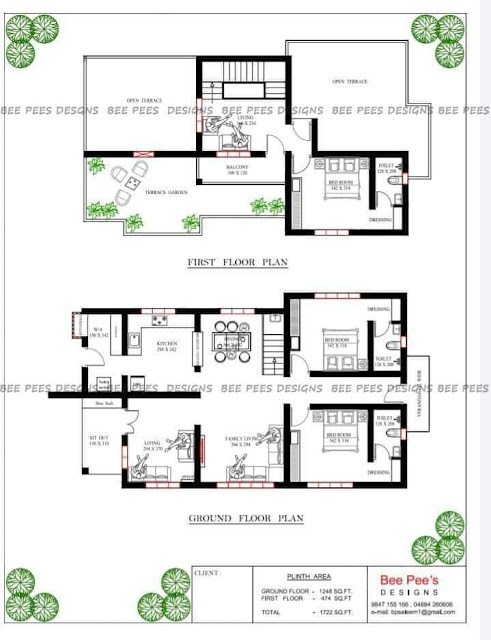
This screenshot has width=491, height=640. In order to click on floor labels in this screenshot , I will do `click(235, 518)`, `click(235, 258)`.